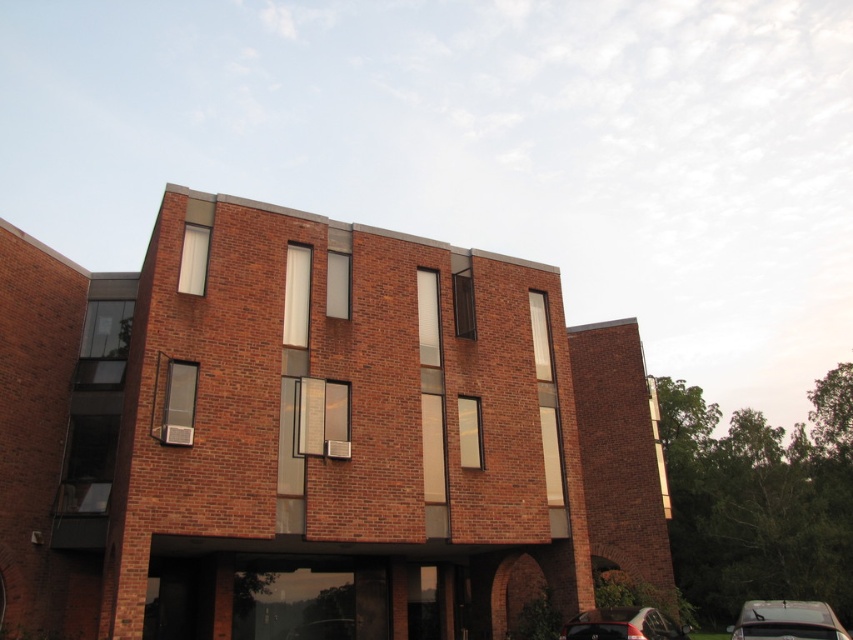
Question: Which point appears closest to the camera in this image?

Choices:
 (A) (759, 608)
 (B) (668, 630)

Answer: (A)

Question: Among these points, which one is nearest to the camera?

Choices:
 (A) (758, 611)
 (B) (604, 632)

Answer: (A)

Question: Does metallic silver car at lower right come behind shiny black car at lower right?

Choices:
 (A) no
 (B) yes

Answer: (A)

Question: Is metallic silver car at lower right positioned before shiny black car at lower right?

Choices:
 (A) yes
 (B) no

Answer: (A)

Question: Is metallic silver car at lower right further to camera compared to shiny black car at lower right?

Choices:
 (A) yes
 (B) no

Answer: (B)